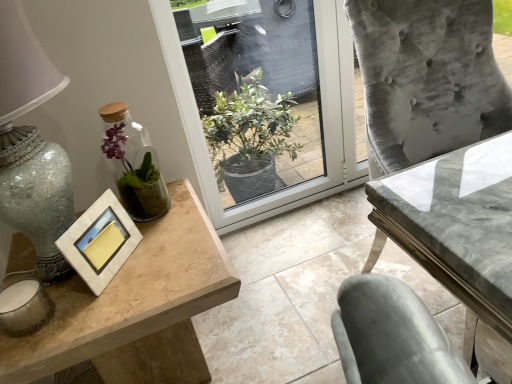
You are a GUI agent. You are given a task and a screenshot of the screen. Output one action in this format:
    pyautogui.click(x=<x>, y=<y>)
    Task: Click on the vacant space that is in between transparent glass window at center and wooden table at left, marked as the second table in a right-to-left arrangement
    The width and height of the screenshot is (512, 384).
    Given the screenshot: What is the action you would take?
    pyautogui.click(x=277, y=270)